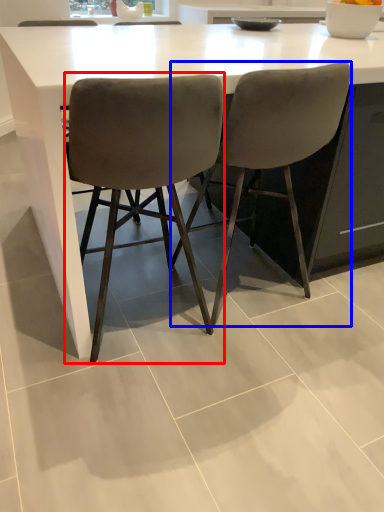
Question: Which object is closer to the camera taking this photo, chair (highlighted by a red box) or chair (highlighted by a blue box)?

Choices:
 (A) chair
 (B) chair

Answer: (A)